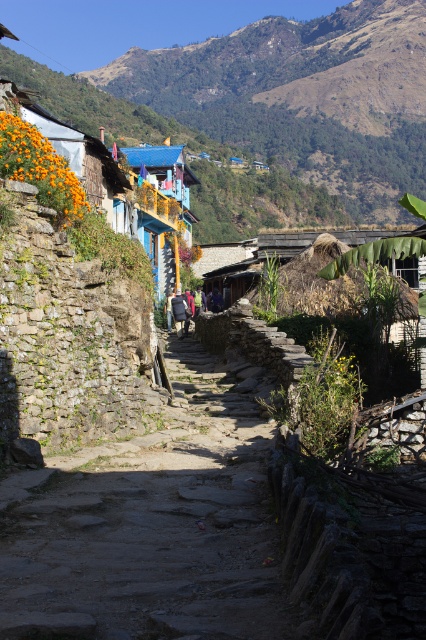
Question: Can you confirm if natural stone path at center is smaller than matte orange wall at left?

Choices:
 (A) no
 (B) yes

Answer: (B)

Question: Is natural stone path at center positioned behind matte orange wall at left?

Choices:
 (A) yes
 (B) no

Answer: (B)

Question: Among these objects, which one is farthest from the camera?

Choices:
 (A) matte orange wall at left
 (B) natural stone path at center

Answer: (A)

Question: Where is natural stone path at center located in relation to matte orange wall at left in the image?

Choices:
 (A) above
 (B) below

Answer: (B)